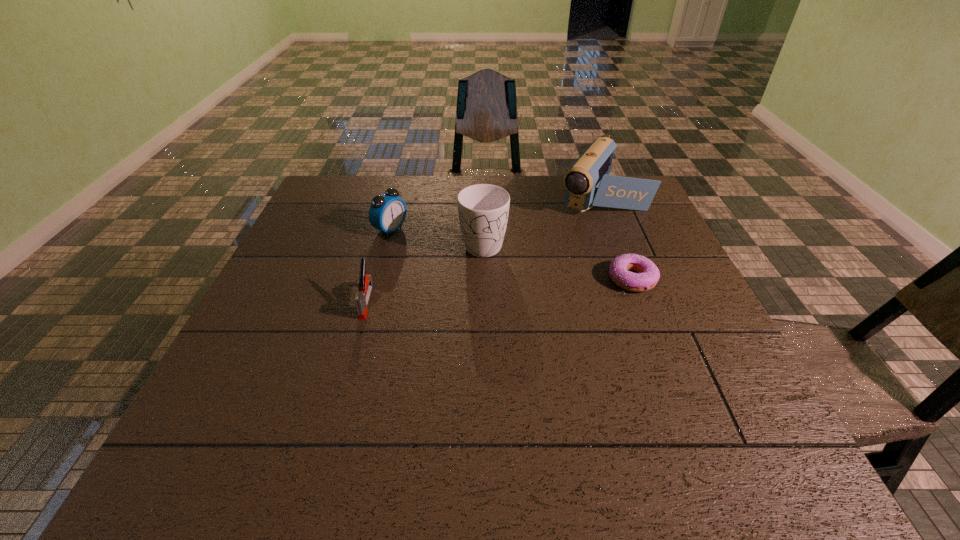
This screenshot has height=540, width=960. Find the location of `stapler`. stapler is located at coordinates click(x=362, y=298).

At what (x,y) coordinates should I click in order to perform the action: click on the shortest object. Please return your answer as a coordinate pair (x, y). Image resolution: width=960 pixels, height=540 pixels. Looking at the image, I should click on click(x=648, y=274).

I want to click on mug, so click(x=483, y=209).

The width and height of the screenshot is (960, 540). Identify the location of alarm clock. (387, 212).

Locate an element on the screen. Image resolution: width=960 pixels, height=540 pixels. camcorder is located at coordinates (588, 179).

At what (x,y) coordinates should I click in order to perform the action: click on vacant region located on the handle side of the stapler. Please return your answer as a coordinate pair (x, y). This screenshot has width=960, height=540. Looking at the image, I should click on (357, 336).

Locate an element on the screen. The height and width of the screenshot is (540, 960). vacant space located on the back of the doughnut is located at coordinates (619, 247).

You are a GUI agent. You are given a task and a screenshot of the screen. Output one action in this format:
    pyautogui.click(x=<x>, y=<y>)
    Task: Click on the free space located 0.280m on the side of the mug with the handle
    The width and height of the screenshot is (960, 540).
    Given the screenshot: What is the action you would take?
    pyautogui.click(x=487, y=345)

Identify the location of vacant space located 0.180m on the side of the mug with the handle. (485, 312).

At what (x,y) coordinates should I click in order to perform the action: click on free space located 0.370m on the side of the mug with the handle. Please return your answer as a coordinate pair (x, y). The width and height of the screenshot is (960, 540). Looking at the image, I should click on (488, 380).